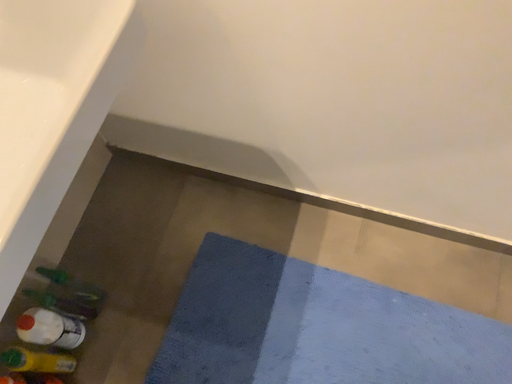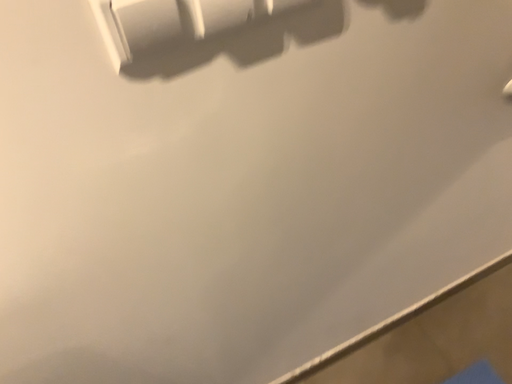
Question: Which way did the camera rotate in the video?

Choices:
 (A) rotated downward
 (B) rotated upward

Answer: (B)